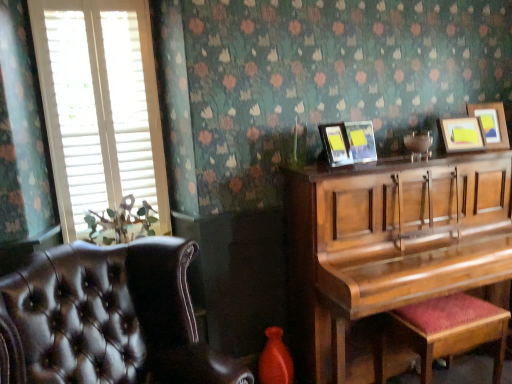
Question: Is white wood blinds at left closer to the viewer compared to wooden picture frame at upper right, acting as the 4th picture frame starting from the left?

Choices:
 (A) yes
 (B) no

Answer: (A)

Question: Are white wood blinds at left and wooden picture frame at upper right, arranged as the first picture frame when viewed from the right, beside each other?

Choices:
 (A) yes
 (B) no

Answer: (B)

Question: Is white wood blinds at left thinner than wooden picture frame at upper right, acting as the 4th picture frame starting from the left?

Choices:
 (A) no
 (B) yes

Answer: (B)

Question: Is white wood blinds at left oriented away from wooden picture frame at upper right, acting as the 4th picture frame starting from the left?

Choices:
 (A) yes
 (B) no

Answer: (B)

Question: Does white wood blinds at left contain wooden picture frame at upper right, arranged as the first picture frame when viewed from the right?

Choices:
 (A) no
 (B) yes

Answer: (A)

Question: From a real-world perspective, is white wood blinds at left on top of wooden picture frame at upper right, acting as the 4th picture frame starting from the left?

Choices:
 (A) yes
 (B) no

Answer: (A)

Question: Can you confirm if leather at left is thinner than shiny brown piano at right?

Choices:
 (A) no
 (B) yes

Answer: (A)

Question: Can you confirm if leather at left is wider than shiny brown piano at right?

Choices:
 (A) yes
 (B) no

Answer: (A)

Question: Is shiny brown piano at right at the back of leather at left?

Choices:
 (A) no
 (B) yes

Answer: (A)

Question: Can shiny brown piano at right be found inside leather at left?

Choices:
 (A) no
 (B) yes

Answer: (A)

Question: Considering the relative positions of leather at left and shiny brown piano at right in the image provided, is leather at left to the right of shiny brown piano at right from the viewer's perspective?

Choices:
 (A) yes
 (B) no

Answer: (B)

Question: Would you say leather at left is a long distance from shiny brown piano at right?

Choices:
 (A) no
 (B) yes

Answer: (A)

Question: Can you confirm if wooden picture frame at upper right, which ranks as the 4th picture frame in right-to-left order, is bigger than white wood blinds at left?

Choices:
 (A) no
 (B) yes

Answer: (A)